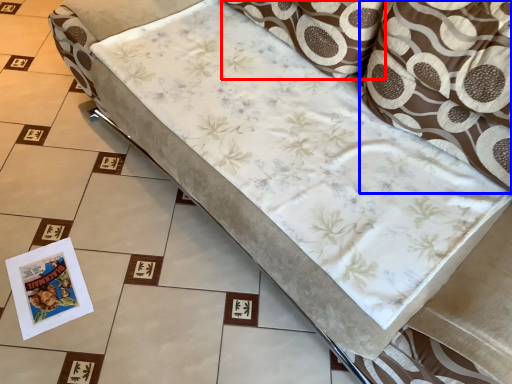
Question: Which point is closer to the camera, pillow (highlighted by a red box) or throw pillow (highlighted by a blue box)?

Choices:
 (A) pillow
 (B) throw pillow

Answer: (B)